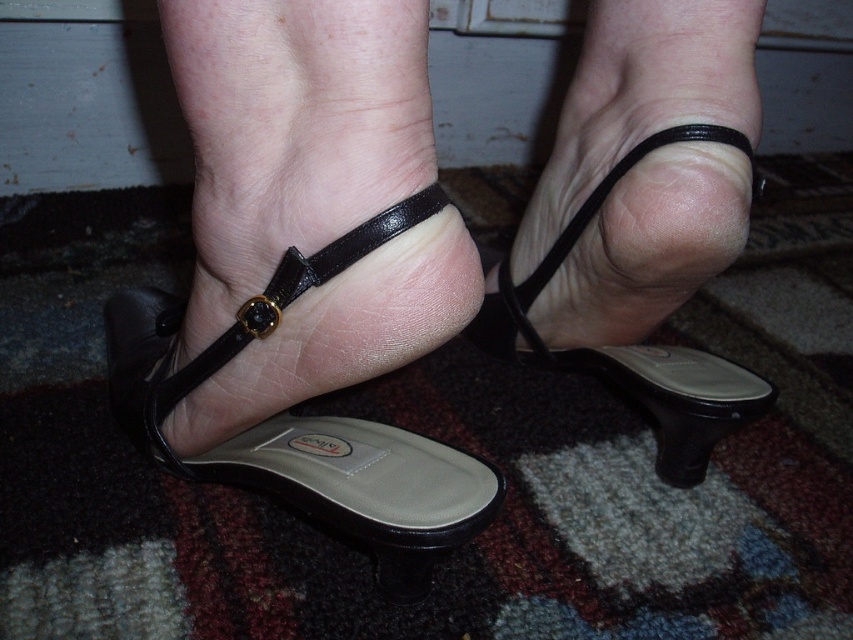
You are a shoemaker examining two items in the image. You need to determine if the black leather sandal at lower left can be placed next to the black leather strap at center without overlapping. The minimum required space between items is 3 inches. Can they be placed without overlapping?

The black leather sandal at lower left is 3.13 inches from the black leather strap at center, which is just over the 3 inch requirement. Therefore, they can be placed without overlapping as there is sufficient space between them.

You are examining two points on the image of the feet wearing black high heels. Which point is closer to you, point (709, 364) or point (403, 204)?

Point (709, 364) is closer to you than point (403, 204).